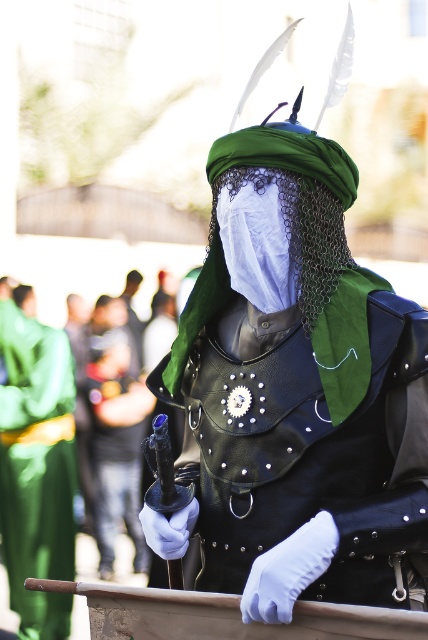
Question: Is leather armor at center smaller than green leather robe at left?

Choices:
 (A) no
 (B) yes

Answer: (B)

Question: Which of the following is the closest to the observer?

Choices:
 (A) (249, 417)
 (B) (62, 618)

Answer: (A)

Question: Does leather armor at center appear on the left side of green leather robe at left?

Choices:
 (A) no
 (B) yes

Answer: (A)

Question: Can you confirm if leather armor at center is thinner than green leather robe at left?

Choices:
 (A) no
 (B) yes

Answer: (A)